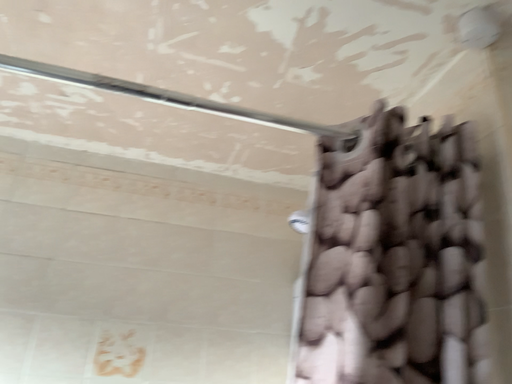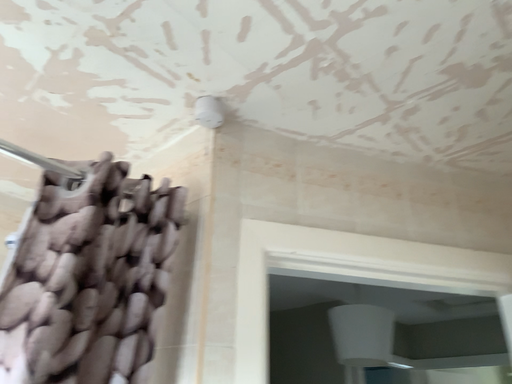
Question: How did the camera likely rotate when shooting the video?

Choices:
 (A) rotated left
 (B) rotated right

Answer: (B)